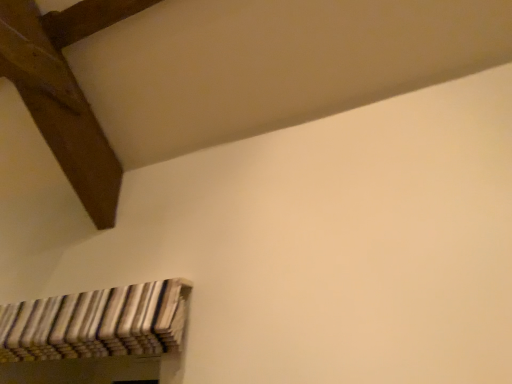
Where is `wooden piano keys at lower left`? The image size is (512, 384). wooden piano keys at lower left is located at coordinates (97, 323).

The height and width of the screenshot is (384, 512). Describe the element at coordinates (97, 323) in the screenshot. I see `wooden piano keys at lower left` at that location.

At what (x,y) coordinates should I click in order to perform the action: click on wooden piano keys at lower left. Please return your answer as a coordinate pair (x, y). Looking at the image, I should click on (97, 323).